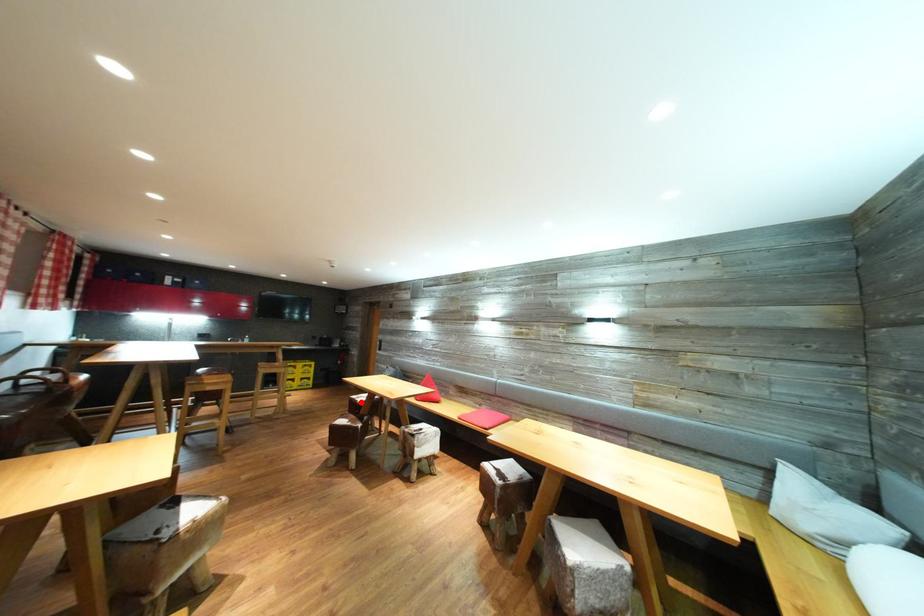
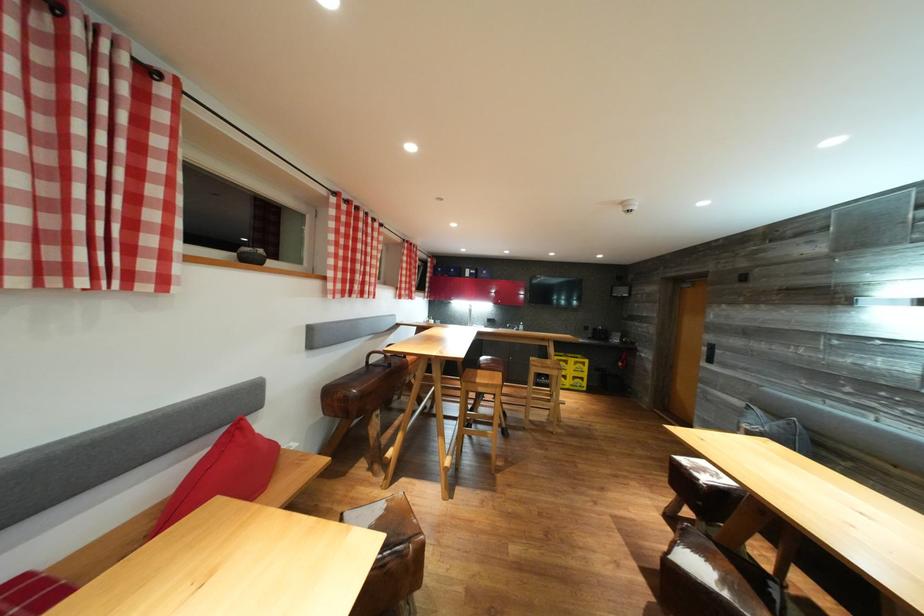
Where in the second image is the point corresponding to the highlighted location from the first image?

(689, 466)